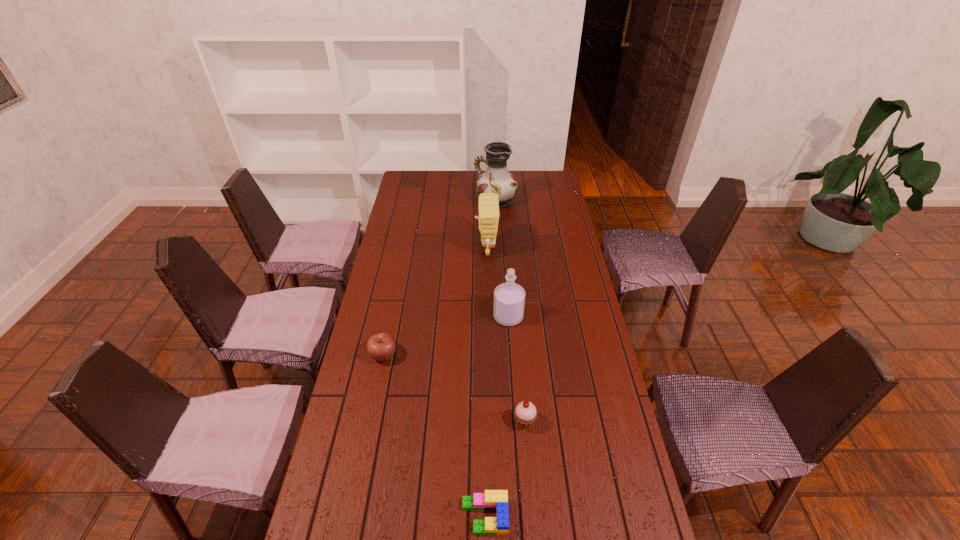
This screenshot has width=960, height=540. What are the coordinates of `free area in between the leftmost object and the perfume` in the screenshot? It's located at (445, 336).

Find the location of `free space between the sponge and the fourth nearest object`. free space between the sponge and the fourth nearest object is located at coordinates (497, 283).

Find the location of a particular element. The width and height of the screenshot is (960, 540). the closest object to the leftmost object is located at coordinates (509, 298).

Locate which object is the fifth closest to the sponge. Please provide its 2D coordinates. Your answer should be formatted as a tuple, i.e. [(x, y)], where the tuple contains the x and y coordinates of a point satisfying the conditions above.

[(497, 500)]

Locate an element on the screen. free spot that satisfies the following two spatial constraints: 1. on the face of the sponge; 2. on the back side of the cupcake is located at coordinates (490, 422).

Where is `free spot that satisfies the following two spatial constraints: 1. on the side of the fifth tallest object with the unique marking; 2. on the right side of the Lego`? free spot that satisfies the following two spatial constraints: 1. on the side of the fifth tallest object with the unique marking; 2. on the right side of the Lego is located at coordinates (350, 516).

This screenshot has width=960, height=540. In order to click on free space in the image that satisfies the following two spatial constraints: 1. on the side of the second shortest object with the unique marking; 2. on the right side of the nearest object in this screenshot , I will do point(350,516).

Image resolution: width=960 pixels, height=540 pixels. Identify the location of free space that satisfies the following two spatial constraints: 1. on the side of the apple with the unique marking; 2. on the back side of the second nearest object. (370, 422).

You are a GUI agent. You are given a task and a screenshot of the screen. Output one action in this format:
    pyautogui.click(x=<x>, y=<y>)
    Task: Click on the free space that satisfies the following two spatial constraints: 1. on the front side of the vase; 2. on the face of the sponge
    
    Given the screenshot: What is the action you would take?
    pyautogui.click(x=497, y=249)

Locate an element on the screen. The width and height of the screenshot is (960, 540). vacant position in the image that satisfies the following two spatial constraints: 1. on the side of the Lego with the unique marking; 2. on the right side of the third nearest object is located at coordinates (350, 516).